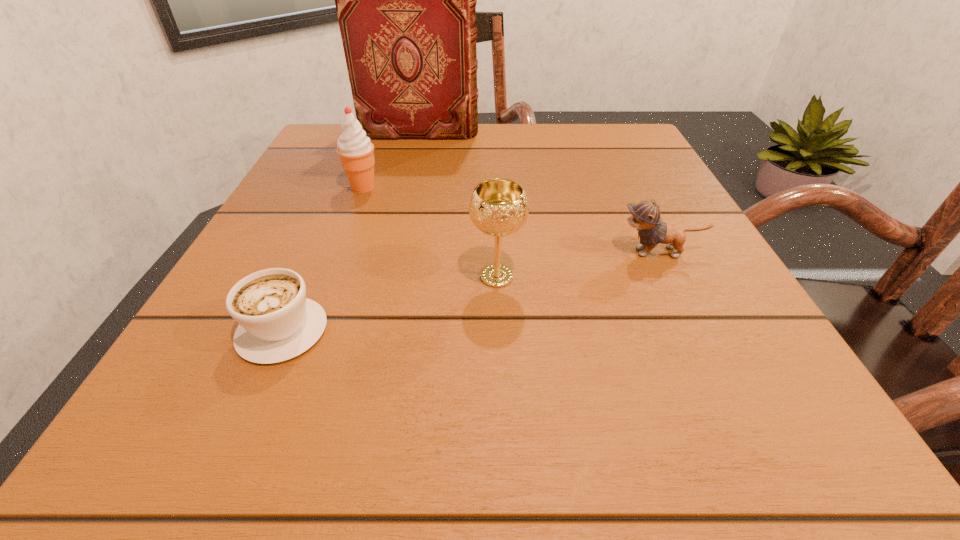
I want to click on the tallest object, so click(x=406, y=0).

You are a GUI agent. You are given a task and a screenshot of the screen. Output one action in this format:
    pyautogui.click(x=<x>, y=<y>)
    Task: Click on the farthest object
    
    Given the screenshot: What is the action you would take?
    pyautogui.click(x=406, y=0)

You are a GUI agent. You are given a task and a screenshot of the screen. Output one action in this format:
    pyautogui.click(x=<x>, y=<y>)
    Task: Click on the fourth nearest object
    The height and width of the screenshot is (540, 960).
    Given the screenshot: What is the action you would take?
    coord(355,149)

This screenshot has height=540, width=960. Find the location of `chalice`. chalice is located at coordinates click(498, 207).

Identify the location of the fourth tallest object. (645, 216).

What are the coordinates of `the rightmost object` in the screenshot? It's located at (645, 216).

At what (x,y) coordinates should I click in order to perform the action: click on cappuccino. Please return your answer as a coordinate pair (x, y). The height and width of the screenshot is (540, 960). Looking at the image, I should click on (277, 322).

Where is `the nearest object`? The image size is (960, 540). the nearest object is located at coordinates (277, 322).

Identify the location of vacant space positioned on the spine side of the hardback book. The image size is (960, 540). (605, 132).

Identify the location of free spot located 0.320m on the front of the fourth nearest object. The height and width of the screenshot is (540, 960). (312, 323).